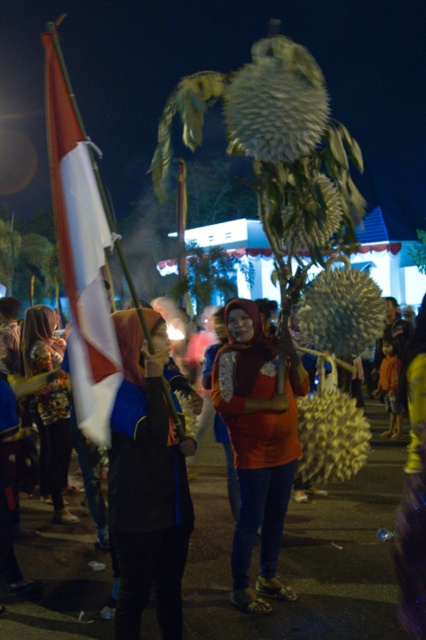
You are a photographer trying to capture the perfect shot of the matte orange hijab at center. The scene is lit by warm artificial lights. Where exactly should you focus your camera to ensure the hijab is in the frame?

Focus your camera at point coordinates (304, 554) to capture the matte orange hijab at center.